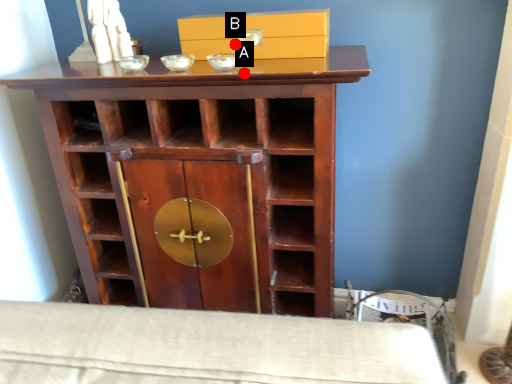
Question: Two points are circled on the image, labeled by A and B beside each circle. Which point is further to the camera?

Choices:
 (A) A is further
 (B) B is further

Answer: (B)